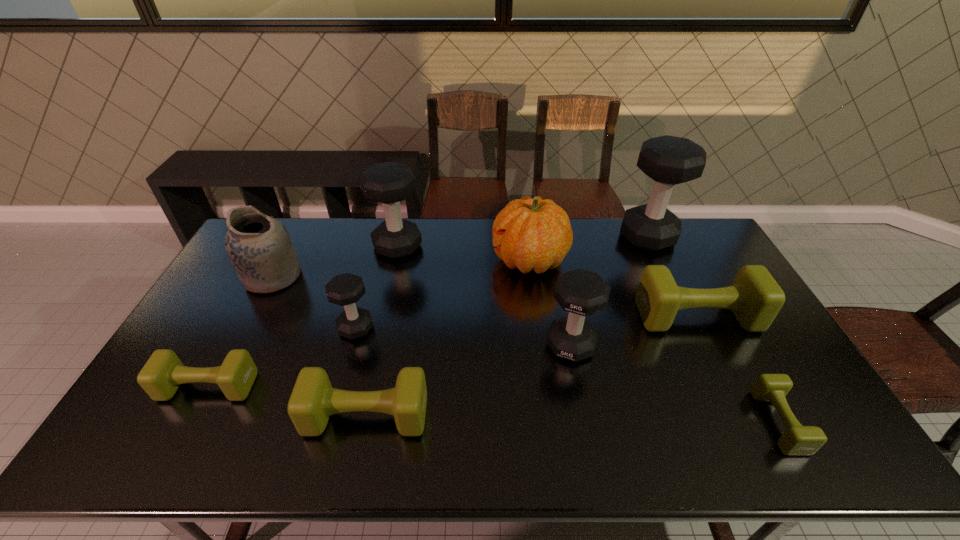
I want to click on vacant region located on the carved face of the orange pumpkin, so click(407, 260).

Locate an element on the screen. The image size is (960, 540). free spot located 0.210m on the right of the pottery is located at coordinates (363, 276).

The height and width of the screenshot is (540, 960). What are the coordinates of `vacant space located 0.110m on the back of the fourth dumbbell from right to left` in the screenshot? It's located at (563, 300).

Locate an element on the screen. Image resolution: width=960 pixels, height=540 pixels. vacant space situated on the left of the smallest gray dumbbell is located at coordinates (248, 328).

You are a GUI agent. You are given a task and a screenshot of the screen. Output one action in this format:
    pyautogui.click(x=<x>, y=<y>)
    Task: Click on the free space located 0.200m on the left of the fourth shortest object
    
    Given the screenshot: What is the action you would take?
    pyautogui.click(x=573, y=316)

At what (x,y) coordinates should I click in order to perform the action: click on vacant region located 0.280m on the back of the eighth tallest object. Please return your answer as a coordinate pair (x, y). Looking at the image, I should click on coord(388,315).

Locate an element on the screen. vacant space located 0.290m on the back of the leftmost olive dumbbell is located at coordinates (256, 296).

This screenshot has height=540, width=960. Find the location of `free space located 0.080m on the right of the smallest olive dumbbell`. free space located 0.080m on the right of the smallest olive dumbbell is located at coordinates (826, 421).

Locate an element on the screen. The width and height of the screenshot is (960, 540). pumpkin that is at the far edge is located at coordinates (530, 234).

Image resolution: width=960 pixels, height=540 pixels. What are the coordinates of `pottery present at the left edge` in the screenshot? It's located at (259, 247).